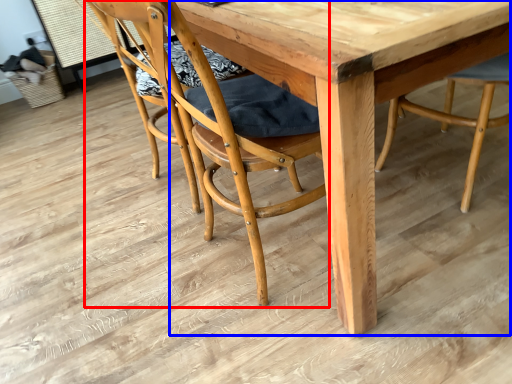
Question: Which point is further to the camera, chair (highlighted by a red box) or round table (highlighted by a blue box)?

Choices:
 (A) chair
 (B) round table

Answer: (A)